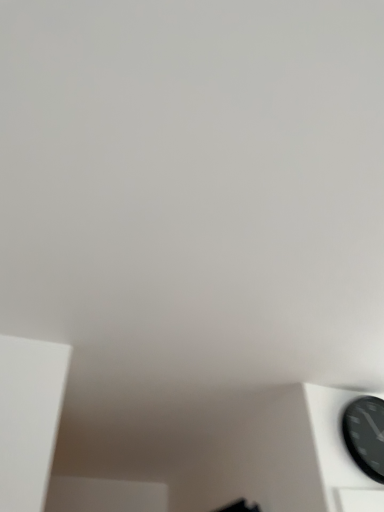
The width and height of the screenshot is (384, 512). What do you see at coordinates (365, 434) in the screenshot?
I see `black glass clock at right` at bounding box center [365, 434].

Find the location of a particular element. The width and height of the screenshot is (384, 512). black glass clock at right is located at coordinates (365, 434).

The image size is (384, 512). What are the coordinates of `black glass clock at right` in the screenshot? It's located at (365, 434).